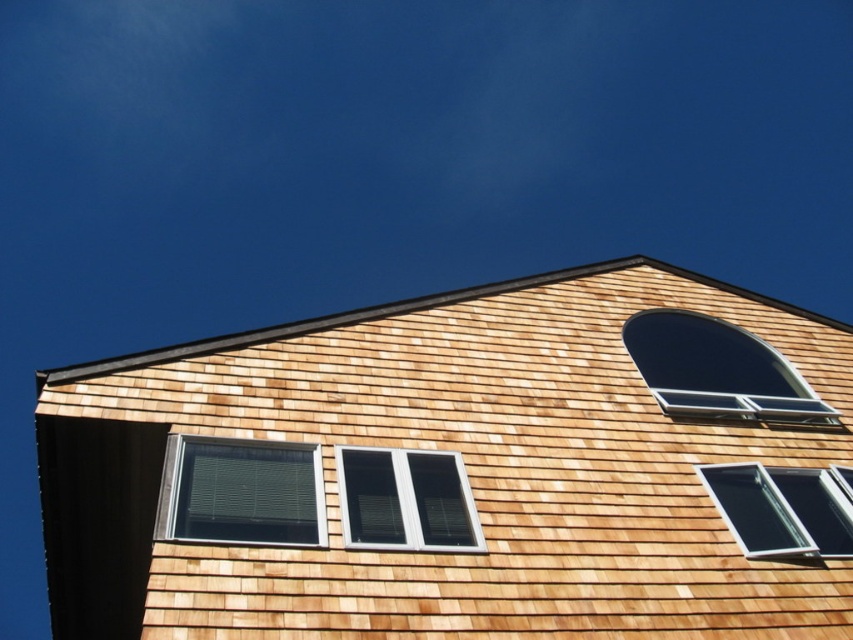
You are standing on the ground looking up at the building. The white plastic window at center is located at coordinates 0.781, 0.477. If you were to draw a straight line from your eye level to this window, would it intersect any other windows on the building?

The white plastic window at center is positioned at point (405, 499). Since there are three rectangular windows below the arched window on the right side of the roof, but the coordinates provided for the white plastic window at center do not indicate any overlap or intersection with other windows along the line of sight, it is likely that the straight line from your eye level to this window would not intersect any other windows.

You are an architect analyzing the building facade. You notice the dark glass window at upper right and the clear glass window at lower right. Which window has a greater width?

The clear glass window at lower right has a greater width since it is thicker than the dark glass window at upper right.

You are standing in front of the building and want to know which window is closer to you. The dark glass window at upper right and the clear glass window at lower right are both visible. Which one is nearer?

The dark glass window at upper right is closer to you because it is positioned further to the viewer than the clear glass window at lower right.